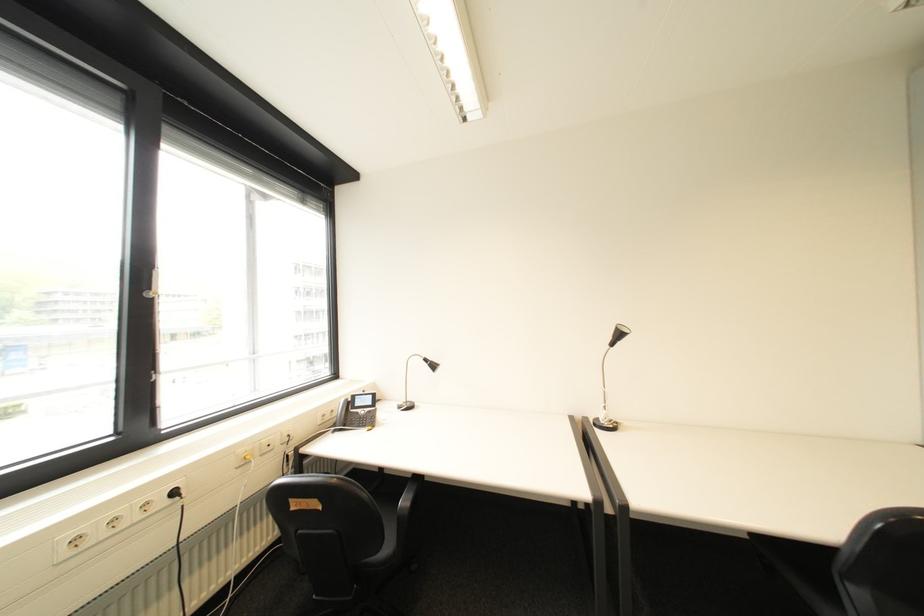
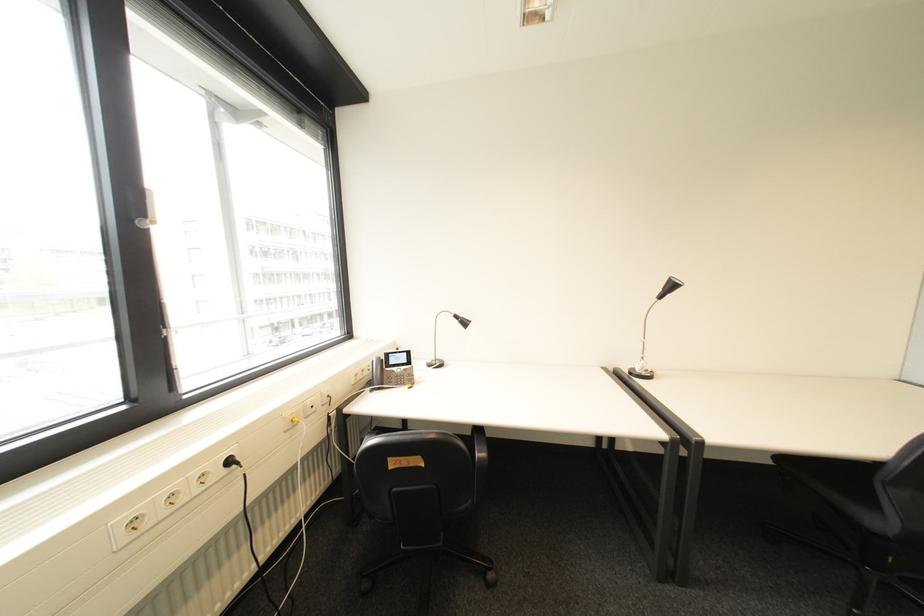
In the second image, find the point that corresponds to (x=185, y=493) in the first image.

(239, 463)